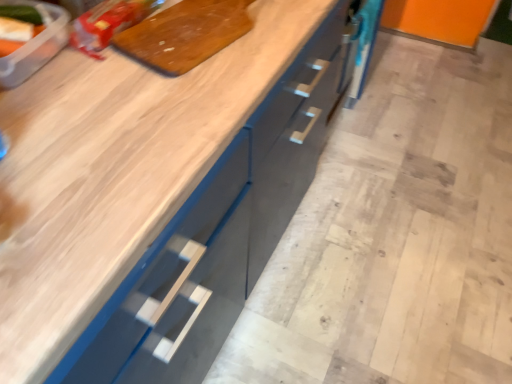
Where is `free space in front of wooden cutting board at upper center`? The width and height of the screenshot is (512, 384). free space in front of wooden cutting board at upper center is located at coordinates (161, 103).